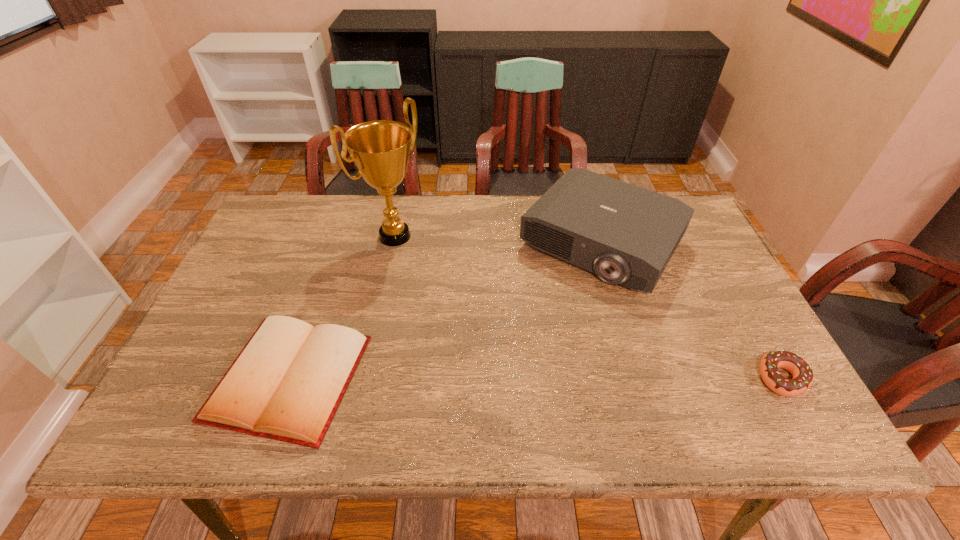
The image size is (960, 540). I want to click on free space that satisfies the following two spatial constraints: 1. on the back side of the Bible; 2. on the left side of the third object from left to right, so pos(337,243).

Where is `blank area in the image that satisfies the following two spatial constraints: 1. on the front side of the second tallest object; 2. on the left side of the rightmost object`? Image resolution: width=960 pixels, height=540 pixels. blank area in the image that satisfies the following two spatial constraints: 1. on the front side of the second tallest object; 2. on the left side of the rightmost object is located at coordinates (641, 378).